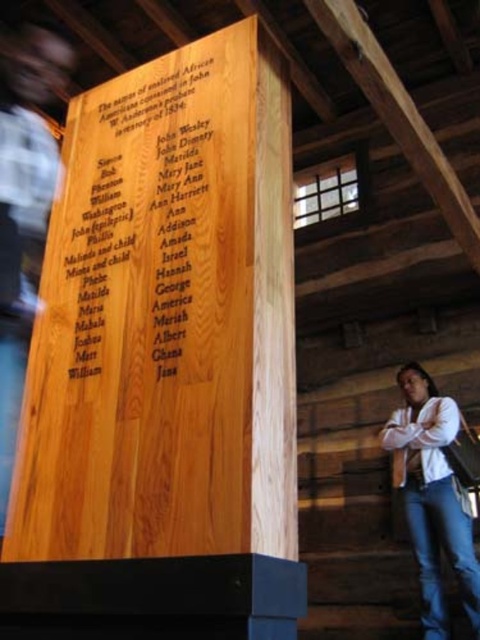
Looking at this image, you are a tour guide standing 1.5 meters away from the wooden plaque at center. You want to ensure visitors can read the names engraved on it without getting too close. Is the current distance sufficient for comfortable reading?

The wooden plaque at center is 1.65 meters away from the camera, which is slightly further than your current position of 1.5 meters. To ensure comfortable reading, visitors should stand closer than 1.65 meters, so the current distance may be sufficient depending on individual eyesight, but some might need to step a bit nearer.

You are standing in the rustic wooden structure and want to locate the wooden plaque at center. According to the coordinates provided, where should you look relative to the room?

The wooden plaque at center is located at coordinates point [132,212], which means it is positioned one third from the left and slightly below the center point of the room.